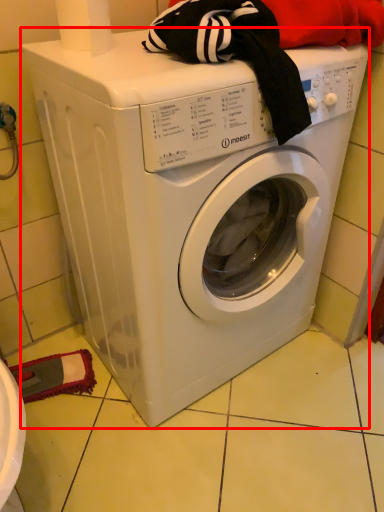
Question: Where is washing machine (annotated by the red box) located in relation to toilet paper in the image?

Choices:
 (A) left
 (B) right

Answer: (B)